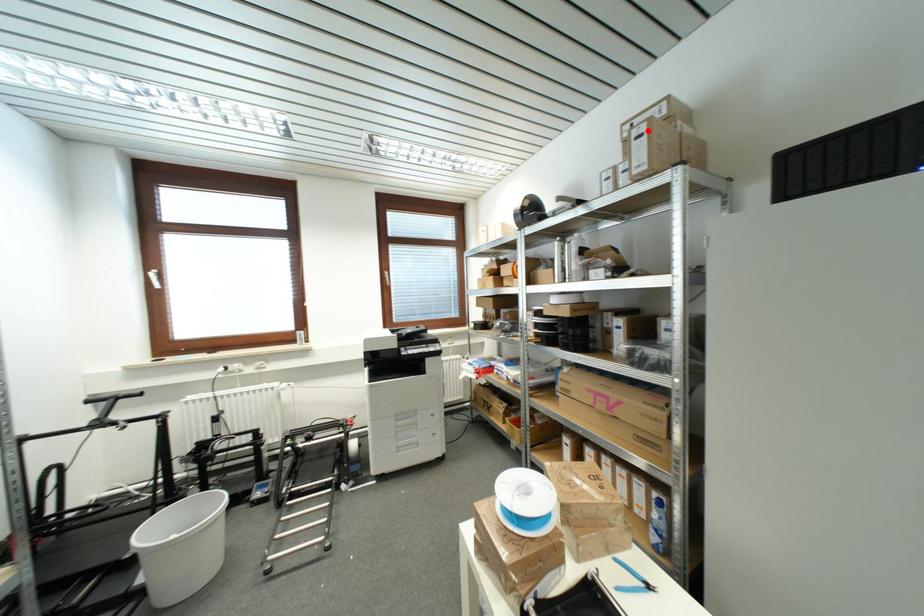
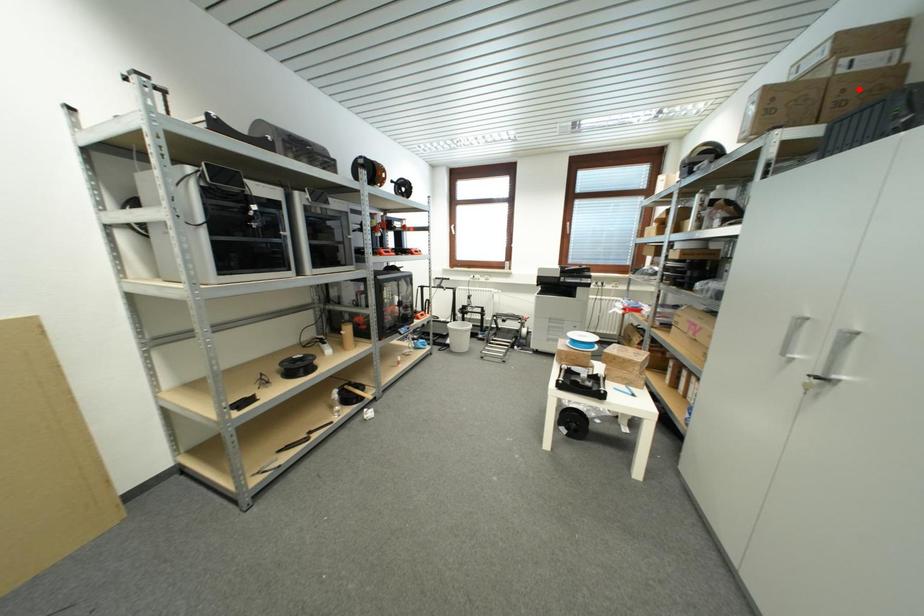
I am providing you with two images of the same scene from different viewpoints. A red point is marked on the first image and another point is marked on the second image. Is the red point in image1 aligned with the point shown in image2?

No